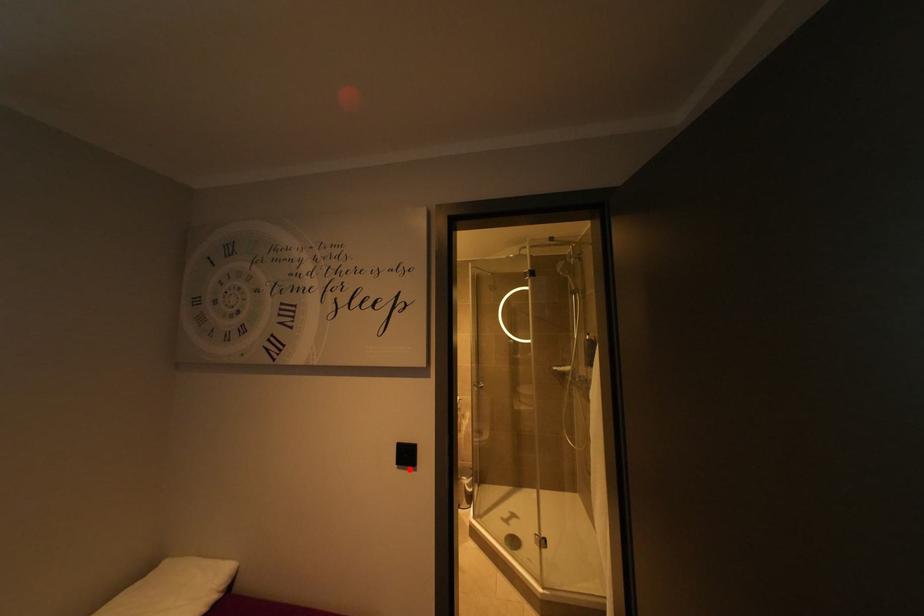
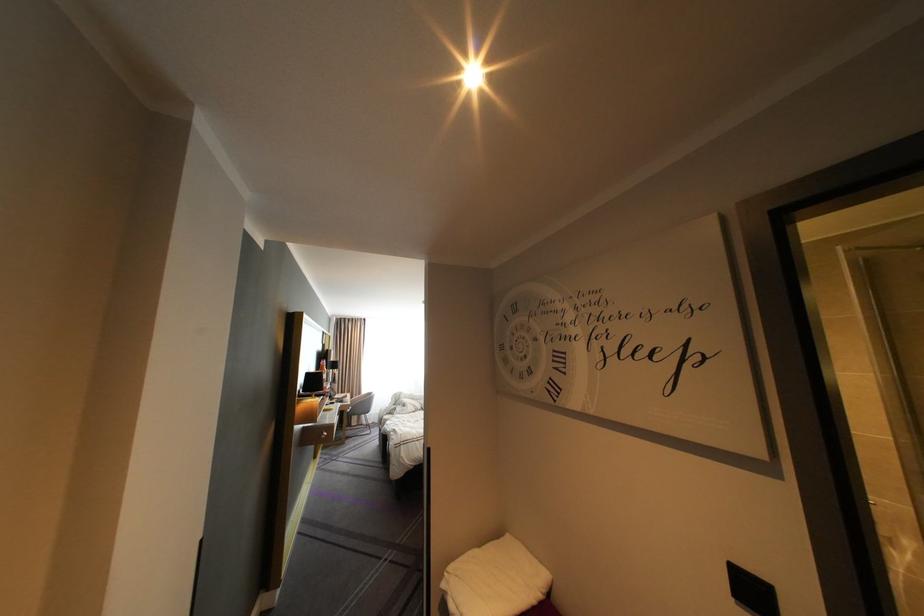
In the second image, find the point that corresponds to the highlighted location in the first image.

(748, 604)